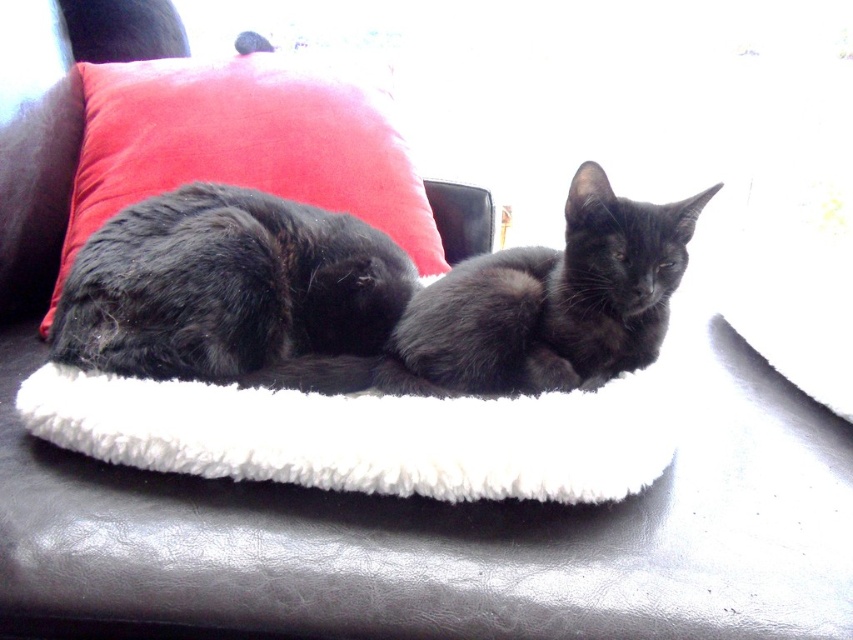
Between fluffy black cat at center and black fur cat at center, which one has less height?

fluffy black cat at center

Does fluffy black cat at center have a smaller size compared to black fur cat at center?

No, fluffy black cat at center is not smaller than black fur cat at center.

Where is `fluffy black cat at center`? Image resolution: width=853 pixels, height=640 pixels. fluffy black cat at center is located at coordinates (227, 285).

Identify the location of fluffy black cat at center. (227, 285).

Between fluffy black cat at center and velvet red pillow at upper left, which one has more height?

With more height is velvet red pillow at upper left.

Image resolution: width=853 pixels, height=640 pixels. I want to click on fluffy black cat at center, so point(227,285).

Between point (123, 328) and point (326, 83), which one is positioned in front?

Point (123, 328) is more forward.

Identify the location of fluffy black cat at center. This screenshot has height=640, width=853. (227, 285).

From the picture: Can you confirm if velvet red pillow at upper left is bigger than black fur cat at center?

Correct, velvet red pillow at upper left is larger in size than black fur cat at center.

Does point (350, 116) lie in front of point (476, 385)?

No, (350, 116) is further to viewer.

Identify the location of velvet red pillow at upper left. This screenshot has width=853, height=640. (245, 145).

Where is `velvet red pillow at upper left`? This screenshot has width=853, height=640. velvet red pillow at upper left is located at coordinates (245, 145).